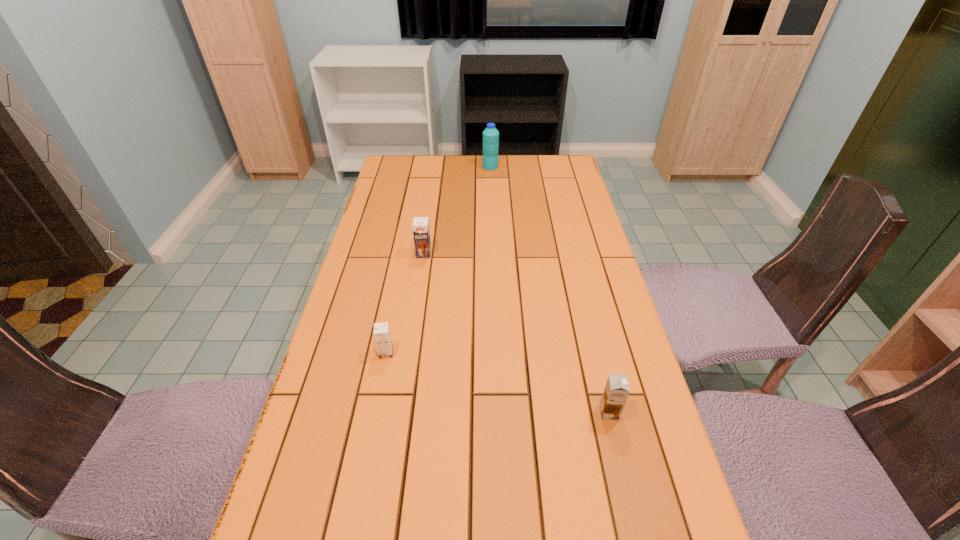
At what (x,y) coordinates should I click in order to perform the action: click on water bottle. Please return your answer as a coordinate pair (x, y). This screenshot has height=540, width=960. Looking at the image, I should click on [490, 135].

Identify the location of the farthest object. (490, 135).

Where is `the farthest chocolate milk`? This screenshot has height=540, width=960. the farthest chocolate milk is located at coordinates (421, 232).

You are a GUI agent. You are given a task and a screenshot of the screen. Output one action in this format:
    pyautogui.click(x=<x>, y=<y>)
    Task: Click on the second chocolate milk from right to left
    Image resolution: width=960 pixels, height=540 pixels.
    Given the screenshot: What is the action you would take?
    [421, 232]

Image resolution: width=960 pixels, height=540 pixels. I want to click on the rightmost chocolate milk, so click(616, 391).

What are the coordinates of `the rightmost object` in the screenshot? It's located at (616, 391).

What are the coordinates of `the shortest object` in the screenshot? It's located at (382, 336).

The width and height of the screenshot is (960, 540). Find the location of `the second farthest chocolate milk`. the second farthest chocolate milk is located at coordinates (382, 336).

This screenshot has height=540, width=960. I want to click on free space located on the left of the second object from right to left, so click(x=458, y=166).

I want to click on blank area located 0.120m on the front label of the farthest chocolate milk, so click(420, 285).